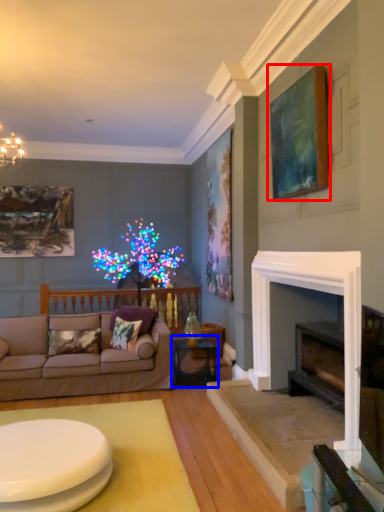
Question: Which object is closer to the camera taking this photo, picture frame (highlighted by a red box) or table (highlighted by a blue box)?

Choices:
 (A) picture frame
 (B) table

Answer: (A)